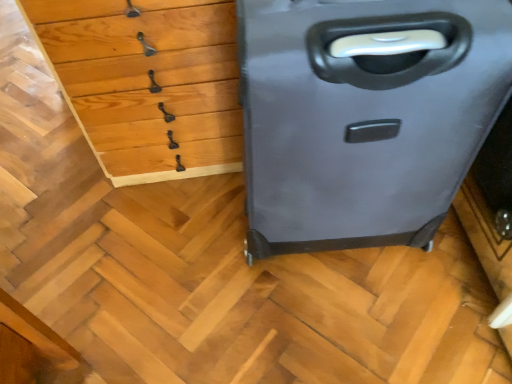
Find the location of `free space to the left of matte gray suitcase at right`. free space to the left of matte gray suitcase at right is located at coordinates [195, 299].